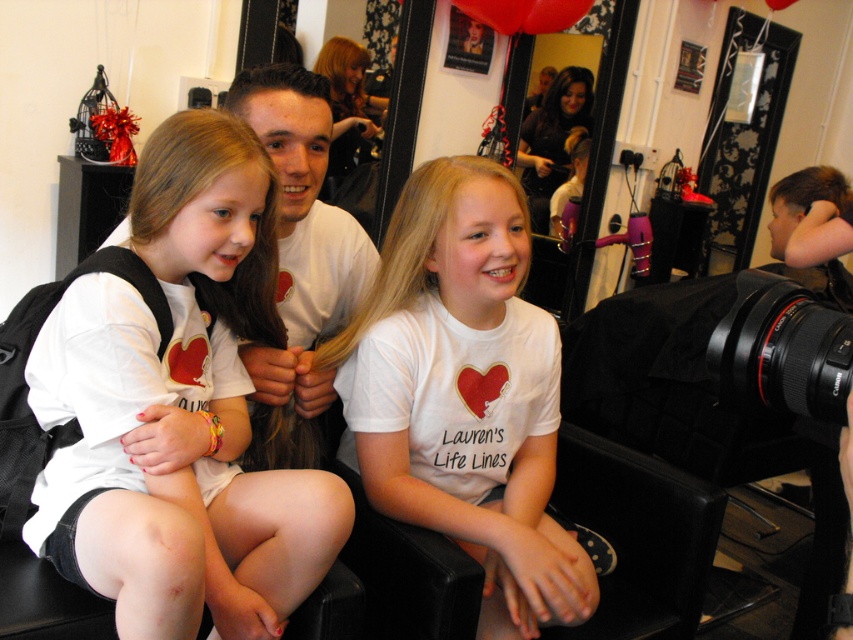
Question: Which point appears farthest from the camera in this image?

Choices:
 (A) [544, 138]
 (B) [445, 182]

Answer: (A)

Question: Is blonde smooth hair at left thinner than blonde silky hair at center?

Choices:
 (A) yes
 (B) no

Answer: (A)

Question: Which point appears closest to the camera in this image?

Choices:
 (A) coord(838,205)
 (B) coord(428,211)

Answer: (B)

Question: Based on their relative distances, which object is farther from the blonde silky hair at center?

Choices:
 (A) blonde silky hair at upper center
 (B) blonde smooth hair at upper right
 (C) white matte t-shirt at center

Answer: (A)

Question: Is blonde silky hair at center positioned at the back of dark brown hair at center?

Choices:
 (A) yes
 (B) no

Answer: (B)

Question: Is blonde hair at center above blonde smooth hair at upper right?

Choices:
 (A) yes
 (B) no

Answer: (A)